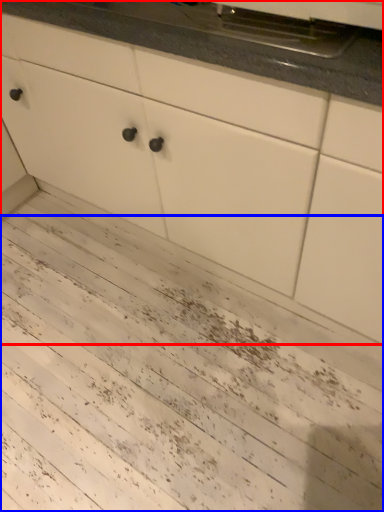
Question: Which object appears closest to the camera in this image, cabinetry (highlighted by a red box) or mud (highlighted by a blue box)?

Choices:
 (A) cabinetry
 (B) mud

Answer: (A)